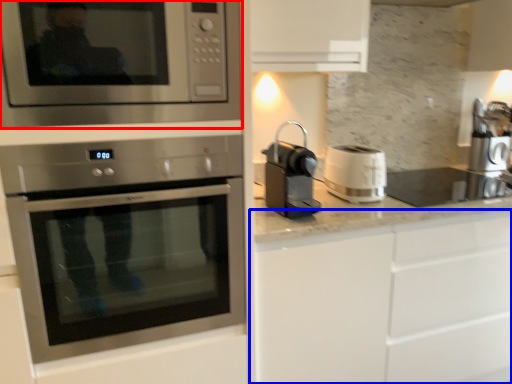
Question: Which point is closer to the camera, microwave oven (highlighted by a red box) or cabinetry (highlighted by a blue box)?

Choices:
 (A) microwave oven
 (B) cabinetry

Answer: (A)